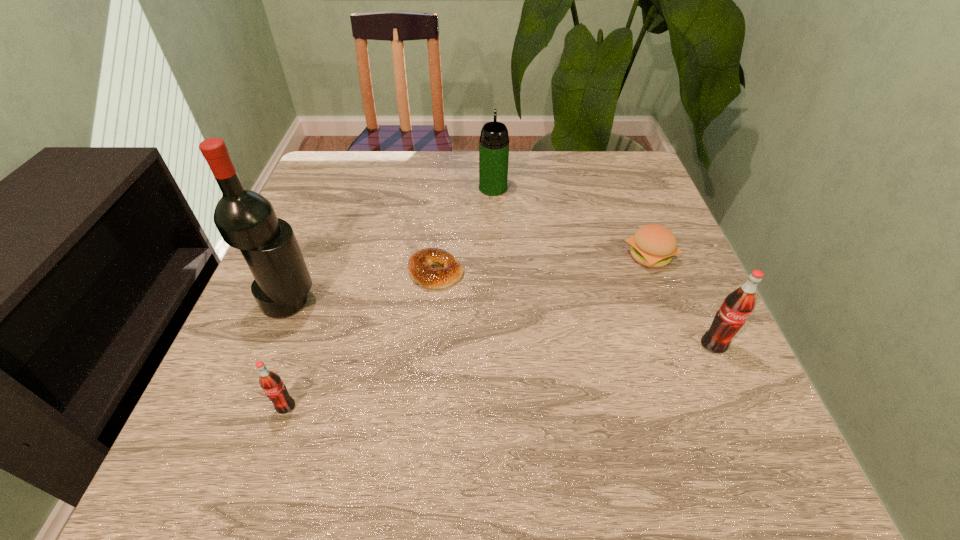
In the image, there is a desktop. Identify the location of vacant area at the far right corner. This screenshot has height=540, width=960. (602, 168).

At what (x,y) coordinates should I click in order to perform the action: click on vacant space at the near right corner of the desktop. Please return your answer as a coordinate pair (x, y). The image size is (960, 540). Looking at the image, I should click on (716, 390).

Where is `empty space between the fourth object from right to left and the right soda bottle`? Image resolution: width=960 pixels, height=540 pixels. empty space between the fourth object from right to left and the right soda bottle is located at coordinates (575, 309).

This screenshot has height=540, width=960. What are the coordinates of `free space between the wine bottle and the hamburger` in the screenshot? It's located at (469, 279).

I want to click on free space between the wine bottle and the second shortest object, so click(469, 279).

Image resolution: width=960 pixels, height=540 pixels. Identify the location of free spot between the farthest object and the shorter soda bottle. (390, 297).

The width and height of the screenshot is (960, 540). I want to click on vacant region between the shorter soda bottle and the farthest object, so click(x=390, y=297).

You are a GUI agent. You are given a task and a screenshot of the screen. Output one action in this format:
    pyautogui.click(x=<x>, y=<y>)
    Task: Click on the free space between the tallest object and the bagel
    The width and height of the screenshot is (960, 540).
    Given the screenshot: What is the action you would take?
    pyautogui.click(x=363, y=287)

Identify the location of vacant area between the left soda bottle and the thermos bottle. This screenshot has height=540, width=960. (390, 297).

Locate an element on the screen. This screenshot has height=540, width=960. free spot between the tallest object and the shortest object is located at coordinates (363, 287).